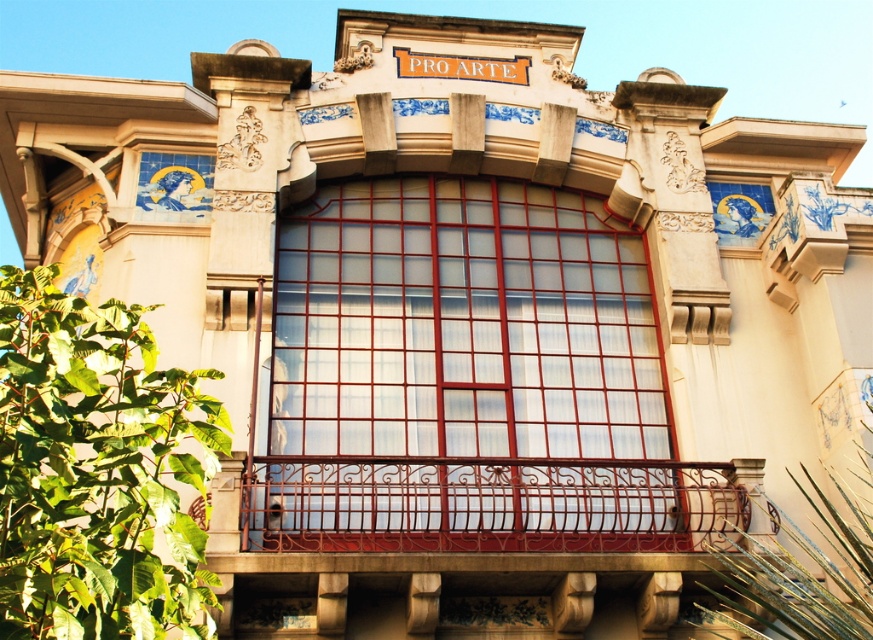
You are an architect examining the building facade. You notice the matte glass window at center and the rusty metal balustrade at center. Which object is located higher up on the facade?

The matte glass window at center is positioned over the rusty metal balustrade at center, so it is located higher up on the facade.

You are a painter standing on a ladder trying to paint the matte glass window at center and the rusty metal balustrade at center. Your ladder can reach up to 3 meters. Can you paint both objects without moving the ladder?

The distance between the matte glass window at center and the rusty metal balustrade at center is 3.46 meters. Since your ladder can only reach up to 3 meters, you cannot paint both objects without moving the ladder because the distance exceeds the ladder reach.

Based on the photo, you are an architect analyzing the building facade. You notice the matte glass window at center and the rusty metal balustrade at center. Which object has a smaller width?

The matte glass window at center is thinner than the rusty metal balustrade at center, so the matte glass window at center has a smaller width.